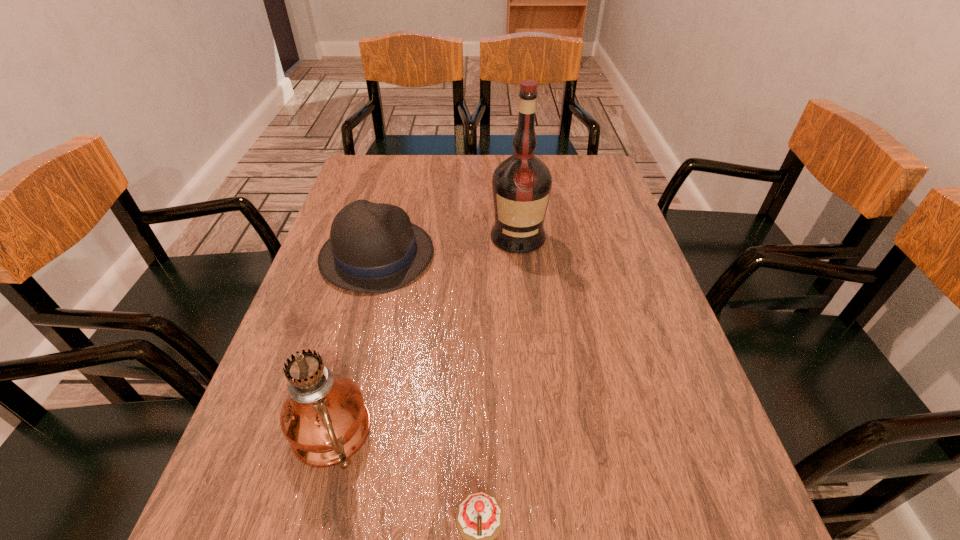
Find the location of a particular element. liquor is located at coordinates (521, 185).

This screenshot has height=540, width=960. In order to click on the second nearest object in this screenshot , I will do `click(324, 418)`.

Image resolution: width=960 pixels, height=540 pixels. I want to click on bowler hat, so click(373, 247).

Find the location of a particular element. The width and height of the screenshot is (960, 540). vacant space situated on the surface of the liquor is located at coordinates (525, 302).

The width and height of the screenshot is (960, 540). Find the location of `blank space located on the right of the second nearest object`. blank space located on the right of the second nearest object is located at coordinates (558, 436).

I want to click on free location located 0.260m on the front-facing side of the third tallest object, so click(533, 255).

Where is `oil lamp located in the left edge section of the desktop`? oil lamp located in the left edge section of the desktop is located at coordinates click(324, 418).

The image size is (960, 540). I want to click on bowler hat located at the left edge, so click(x=373, y=247).

The image size is (960, 540). In the image, there is a desktop. Find the location of `vacant space at the far edge`. vacant space at the far edge is located at coordinates (460, 162).

In order to click on vacant space at the near edge of the desktop in this screenshot , I will do `click(606, 535)`.